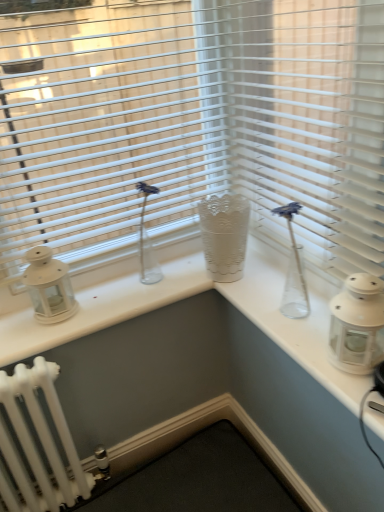
Question: From the image's perspective, would you say white plastic blinds at upper center is positioned over white plastic blinds at center?

Choices:
 (A) no
 (B) yes

Answer: (B)

Question: Can you confirm if white plastic blinds at upper center is taller than white plastic blinds at center?

Choices:
 (A) yes
 (B) no

Answer: (A)

Question: From the image's perspective, does white plastic blinds at upper center appear lower than white plastic blinds at center?

Choices:
 (A) yes
 (B) no

Answer: (B)

Question: Is white plastic blinds at upper center facing towards white plastic blinds at center?

Choices:
 (A) no
 (B) yes

Answer: (B)

Question: Is white plastic blinds at upper center thinner than white plastic blinds at center?

Choices:
 (A) no
 (B) yes

Answer: (A)

Question: Is white plastic blinds at upper center closer to camera compared to white plastic blinds at center?

Choices:
 (A) no
 (B) yes

Answer: (A)

Question: Does white matte lantern at left, which is the second candle holder in right-to-left order, touch white glass lantern at right, which appears as the first candle holder when viewed from the right?

Choices:
 (A) yes
 (B) no

Answer: (B)

Question: Does white matte lantern at left, which is the first candle holder in back-to-front order, have a larger size compared to white glass lantern at right, which appears as the first candle holder when viewed from the right?

Choices:
 (A) yes
 (B) no

Answer: (B)

Question: Considering the relative sizes of white matte lantern at left, positioned as the first candle holder in left-to-right order, and white glass lantern at right, the 2th candle holder viewed from the back, in the image provided, is white matte lantern at left, positioned as the first candle holder in left-to-right order, smaller than white glass lantern at right, the 2th candle holder viewed from the back,?

Choices:
 (A) no
 (B) yes

Answer: (B)

Question: From the image's perspective, is white matte lantern at left, positioned as the first candle holder in left-to-right order, on top of white glass lantern at right, the 2th candle holder viewed from the back?

Choices:
 (A) no
 (B) yes

Answer: (B)

Question: Does white matte lantern at left, positioned as the first candle holder in left-to-right order, turn towards white glass lantern at right, which appears as the first candle holder when viewed from the right?

Choices:
 (A) no
 (B) yes

Answer: (A)

Question: Is white matte lantern at left, placed as the 2th candle holder when sorted from front to back, not inside white glass lantern at right, the first candle holder from the front?

Choices:
 (A) no
 (B) yes

Answer: (B)

Question: Considering the relative sizes of white matte lantern at left, placed as the 2th candle holder when sorted from front to back, and white plastic blinds at upper center in the image provided, is white matte lantern at left, placed as the 2th candle holder when sorted from front to back, bigger than white plastic blinds at upper center?

Choices:
 (A) yes
 (B) no

Answer: (B)